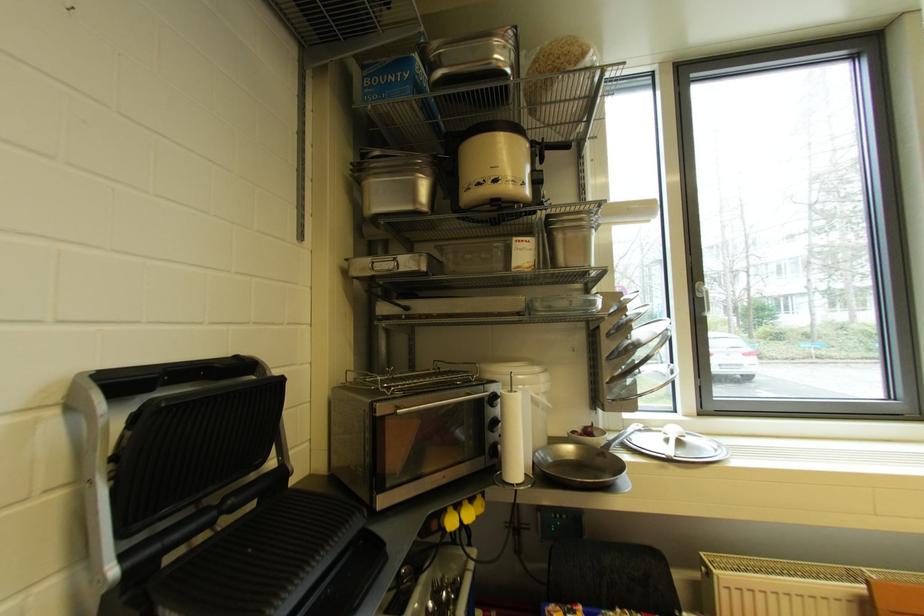
Describe the element at coordinates (702, 297) in the screenshot. This screenshot has width=924, height=616. I see `the window handle` at that location.